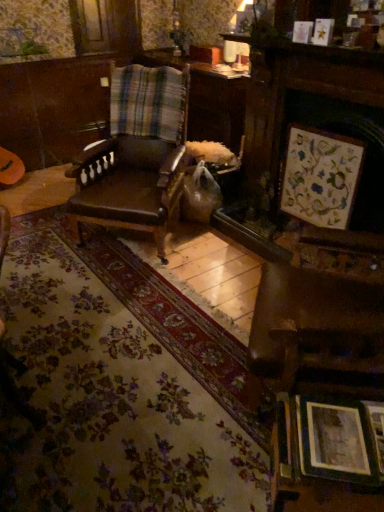
Question: From the image's perspective, is wooden picture frame at lower right, the 1th picture frame positioned from the bottom, under plaid fabric at center?

Choices:
 (A) yes
 (B) no

Answer: (A)

Question: Is wooden picture frame at lower right, the first picture frame in the front-to-back sequence, aimed at plaid fabric at center?

Choices:
 (A) no
 (B) yes

Answer: (A)

Question: Is plaid fabric at center a part of wooden picture frame at lower right, the 5th picture frame positioned from the top?

Choices:
 (A) yes
 (B) no

Answer: (B)

Question: Does wooden picture frame at lower right, the first picture frame in the front-to-back sequence, have a larger size compared to plaid fabric at center?

Choices:
 (A) yes
 (B) no

Answer: (B)

Question: Can you confirm if wooden picture frame at lower right, the first picture frame in the front-to-back sequence, is thinner than plaid fabric at center?

Choices:
 (A) no
 (B) yes

Answer: (B)

Question: In the image, is wooden framed artwork at upper right, arranged as the third picture frame when viewed from the back, on the left side or the right side of wooden picture frame at lower right, arranged as the 5th picture frame when viewed from the back?

Choices:
 (A) left
 (B) right

Answer: (B)

Question: In the image, is wooden framed artwork at upper right, which is counted as the 3th picture frame, starting from the bottom, positioned in front of or behind wooden picture frame at lower right, arranged as the 5th picture frame when viewed from the back?

Choices:
 (A) front
 (B) behind

Answer: (B)

Question: In terms of width, does wooden framed artwork at upper right, which is the 3th picture frame in top-to-bottom order, look wider or thinner when compared to wooden picture frame at lower right, the first picture frame in the front-to-back sequence?

Choices:
 (A) thin
 (B) wide

Answer: (A)

Question: From a real-world perspective, is wooden framed artwork at upper right, marked as the third picture frame in a front-to-back arrangement, positioned above or below wooden picture frame at lower right, arranged as the 5th picture frame when viewed from the back?

Choices:
 (A) above
 (B) below

Answer: (A)

Question: Looking at their shapes, would you say wooden picture frame at upper right, arranged as the second picture frame when viewed from the top, is wider or thinner than plaid fabric at center?

Choices:
 (A) thin
 (B) wide

Answer: (A)

Question: From a real-world perspective, relative to plaid fabric at center, is wooden picture frame at upper right, placed as the 2th picture frame when sorted from back to front, vertically above or below?

Choices:
 (A) above
 (B) below

Answer: (A)

Question: From the image's perspective, is wooden picture frame at upper right, arranged as the second picture frame when viewed from the top, above or below plaid fabric at center?

Choices:
 (A) below
 (B) above

Answer: (B)

Question: Which is correct: wooden picture frame at upper right, placed as the 2th picture frame when sorted from back to front, is inside plaid fabric at center, or outside of it?

Choices:
 (A) inside
 (B) outside

Answer: (B)

Question: From the image's perspective, is wooden picture frame at upper right, which is the 4th picture frame from bottom to top, located above or below wooden framed artwork at upper right, marked as the third picture frame in a front-to-back arrangement?

Choices:
 (A) above
 (B) below

Answer: (A)

Question: Based on their positions, is wooden picture frame at upper right, arranged as the second picture frame when viewed from the top, located to the left or right of wooden framed artwork at upper right, marked as the third picture frame in a front-to-back arrangement?

Choices:
 (A) left
 (B) right

Answer: (A)